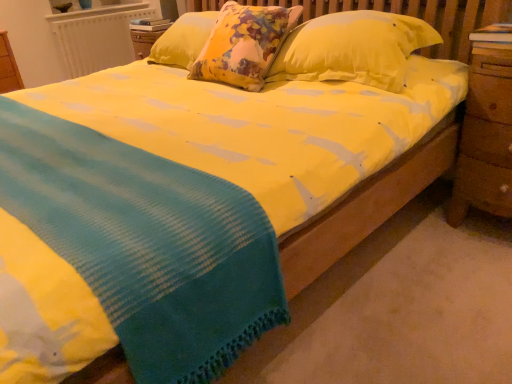
The height and width of the screenshot is (384, 512). Describe the element at coordinates (146, 243) in the screenshot. I see `yellow cotton blanket at center` at that location.

Find the location of a particular element. yellow fabric pillow at center is located at coordinates (244, 44).

What are the coordinates of `radiator that appears behind the yellow cotton blanket at center` in the screenshot? It's located at (96, 36).

Is yellow cotton blanket at center closer to the viewer compared to white textured radiator at upper left?

Yes, yellow cotton blanket at center is closer to the camera.

Is yellow cotton blanket at center wider than white textured radiator at upper left?

Indeed, yellow cotton blanket at center has a greater width compared to white textured radiator at upper left.

Is white textured radiator at upper left at the back of yellow cotton blanket at center?

No, yellow cotton blanket at center is not facing away from white textured radiator at upper left.

Based on the photo, is yellow fabric pillow at center next to yellow cotton blanket at center and touching it?

No.

Does yellow fabric pillow at center have a lesser height compared to yellow cotton blanket at center?

No, yellow fabric pillow at center is not shorter than yellow cotton blanket at center.

The height and width of the screenshot is (384, 512). In order to click on pillow on the right of yellow cotton blanket at center in this screenshot , I will do `click(244, 44)`.

In the image, is yellow fabric pillow at center positioned in front of or behind yellow cotton blanket at center?

Clearly, yellow fabric pillow at center is behind yellow cotton blanket at center.

Is yellow cotton blanket at center shorter than wooden at right?

Yes, yellow cotton blanket at center is shorter than wooden at right.

Measure the distance between yellow cotton blanket at center and wooden at right.

yellow cotton blanket at center and wooden at right are 3.90 feet apart from each other.

Considering the relative positions of yellow cotton blanket at center and wooden at right in the image provided, is yellow cotton blanket at center in front of wooden at right?

That is True.

From a real-world perspective, which is physically above, yellow cotton blanket at center or wooden at right?

In real-world perspective, wooden at right is above.

Considering the sizes of objects yellow fabric pillow at center and white textured radiator at upper left in the image provided, who is wider, yellow fabric pillow at center or white textured radiator at upper left?

yellow fabric pillow at center is wider.

Is point (277, 29) positioned before point (64, 65)?

Yes, it is in front of point (64, 65).

Could you tell me if yellow fabric pillow at center is facing white textured radiator at upper left?

No, yellow fabric pillow at center is not facing towards white textured radiator at upper left.

Is white textured radiator at upper left facing away from wooden at right?

No, white textured radiator at upper left is not facing away from wooden at right.

Considering the sizes of objects white textured radiator at upper left and wooden at right in the image provided, who is wider, white textured radiator at upper left or wooden at right?

With larger width is wooden at right.

How much distance is there between white textured radiator at upper left and wooden at right?

white textured radiator at upper left and wooden at right are 3.14 meters apart.

Is wooden at right located within white textured radiator at upper left?

No.

Between white textured radiator at upper left and yellow cotton blanket at center, which one has smaller size?

Smaller between the two is white textured radiator at upper left.

Considering the points (61, 58) and (244, 307), which point is in front, point (61, 58) or point (244, 307)?

The point (244, 307) is closer.

Consider the image. Does white textured radiator at upper left have a greater height compared to yellow cotton blanket at center?

Yes, white textured radiator at upper left is taller than yellow cotton blanket at center.

From a real-world perspective, is white textured radiator at upper left physically located above or below yellow cotton blanket at center?

From a real-world perspective, white textured radiator at upper left is physically above yellow cotton blanket at center.

Considering the sizes of objects wooden at right and yellow fabric pillow at center in the image provided, who is bigger, wooden at right or yellow fabric pillow at center?

With larger size is yellow fabric pillow at center.

How distant is wooden at right from yellow fabric pillow at center?

A distance of 36.54 inches exists between wooden at right and yellow fabric pillow at center.

Based on the photo, are wooden at right and yellow fabric pillow at center beside each other?

No, wooden at right is not in contact with yellow fabric pillow at center.

Can you confirm if wooden at right is thinner than yellow fabric pillow at center?

Correct, the width of wooden at right is less than that of yellow fabric pillow at center.

You are a GUI agent. You are given a task and a screenshot of the screen. Output one action in this format:
    pyautogui.click(x=<x>, y=<y>)
    Task: Click on the blanket beneath the white textured radiator at upper left (from a real-world perspective)
    This screenshot has height=384, width=512.
    Given the screenshot: What is the action you would take?
    pyautogui.click(x=146, y=243)

At what (x,y) coordinates should I click in order to perform the action: click on pillow that is above the yellow cotton blanket at center (from the image's perspective). Please return your answer as a coordinate pair (x, y). The image size is (512, 384). Looking at the image, I should click on (244, 44).

Estimate the real-world distances between objects in this image. Which object is closer to wooden at right, yellow fabric pillow at center or yellow cotton blanket at center?

yellow fabric pillow at center is closer to wooden at right.

Looking at the image, which one is located further to yellow fabric pillow at center, wooden at right or yellow cotton blanket at center?

yellow cotton blanket at center is further to yellow fabric pillow at center.

Which object lies further to the anchor point wooden at right, white textured radiator at upper left or yellow cotton blanket at center?

Based on the image, white textured radiator at upper left appears to be further to wooden at right.

Looking at the image, which one is located further to yellow cotton blanket at center, yellow fabric pillow at center or wooden at right?

wooden at right is positioned further to the anchor yellow cotton blanket at center.

Which object lies further to the anchor point yellow fabric pillow at center, yellow cotton blanket at center or wooden at right?

The object further to yellow fabric pillow at center is yellow cotton blanket at center.

Looking at the image, which one is located closer to white textured radiator at upper left, yellow fabric pillow at center or yellow cotton blanket at center?

yellow fabric pillow at center is closer to white textured radiator at upper left.

When comparing their distances from white textured radiator at upper left, does yellow cotton blanket at center or yellow fabric pillow at center seem closer?

The object closer to white textured radiator at upper left is yellow fabric pillow at center.

Estimate the real-world distances between objects in this image. Which object is closer to white textured radiator at upper left, wooden at right or yellow fabric pillow at center?

yellow fabric pillow at center.

Locate an element on the screen. This screenshot has width=512, height=384. pillow located between yellow cotton blanket at center and wooden at right in the left-right direction is located at coordinates (244, 44).

The width and height of the screenshot is (512, 384). I want to click on nightstand between yellow cotton blanket at center and white textured radiator at upper left in the front-back direction, so click(486, 129).

You are a GUI agent. You are given a task and a screenshot of the screen. Output one action in this format:
    pyautogui.click(x=<x>, y=<y>)
    Task: Click on the pillow situated between white textured radiator at upper left and wooden at right from left to right
    The width and height of the screenshot is (512, 384).
    Given the screenshot: What is the action you would take?
    pyautogui.click(x=244, y=44)

The height and width of the screenshot is (384, 512). In order to click on pillow located between yellow cotton blanket at center and white textured radiator at upper left in the depth direction in this screenshot , I will do `click(244, 44)`.